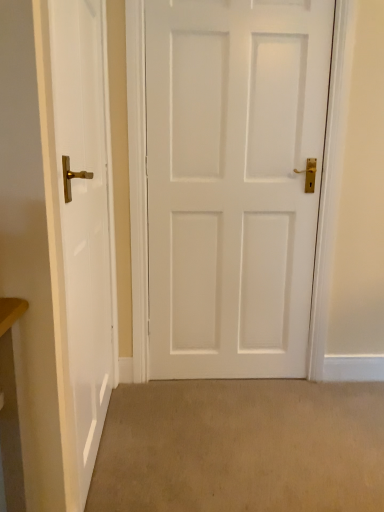
The width and height of the screenshot is (384, 512). Identify the location of free location in front of white matte door at center, the second door positioned from the left. (238, 434).